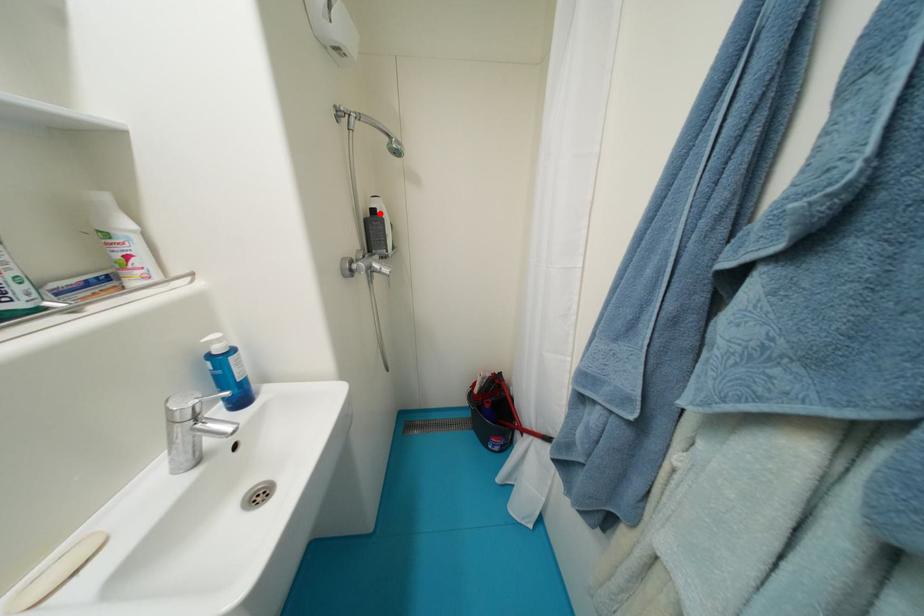
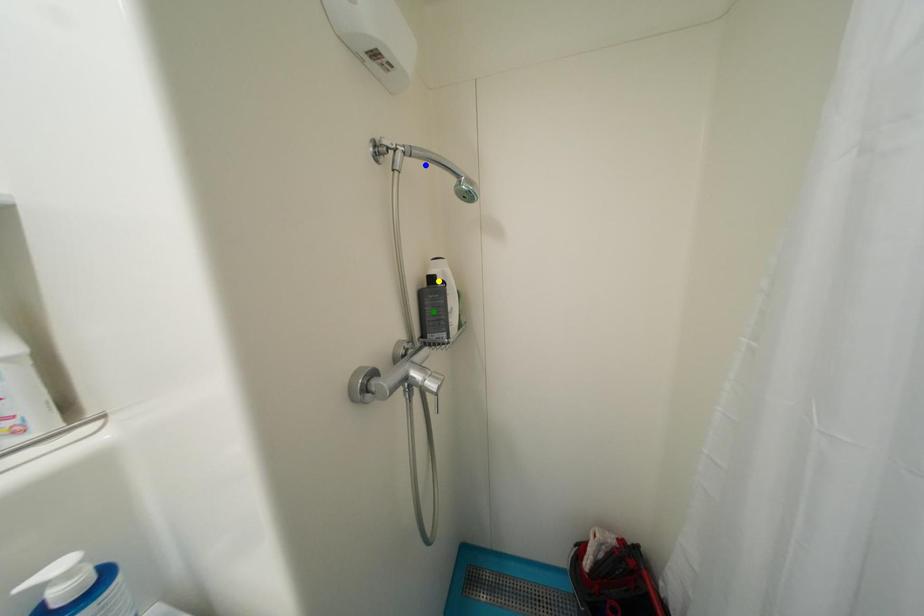
Question: I am providing you with two images of the same scene from different viewpoints. A red point is marked on the first image. You are given multiple points on the second image. Which spot in image 2 lines up with the point in image 1?

Choices:
 (A) blue point
 (B) green point
 (C) yellow point

Answer: (C)